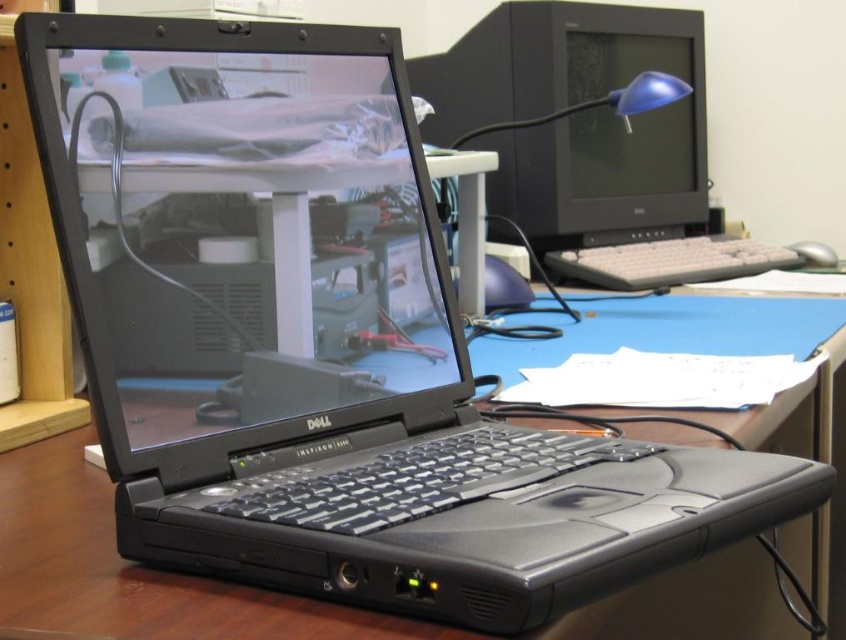
Question: Can you confirm if matte black laptop at center is wider than white plastic keyboard at center?

Choices:
 (A) yes
 (B) no

Answer: (B)

Question: Does white plastic keyboard at center lie behind silver metallic mouse at right?

Choices:
 (A) no
 (B) yes

Answer: (A)

Question: Can you confirm if matte black monitor at upper right is positioned to the left of white plastic keyboard at center?

Choices:
 (A) no
 (B) yes

Answer: (B)

Question: Which object is positioned closest to the matte black monitor at upper right?

Choices:
 (A) white plastic keyboard at center
 (B) silver metallic mouse at right

Answer: (A)

Question: Which point is closer to the camera?

Choices:
 (A) (567, 224)
 (B) (385, 86)
 (C) (792, 253)

Answer: (B)

Question: Which of the following is the farthest from the observer?

Choices:
 (A) matte black monitor at upper right
 (B) silver metallic mouse at right
 (C) white plastic keyboard at center

Answer: (B)